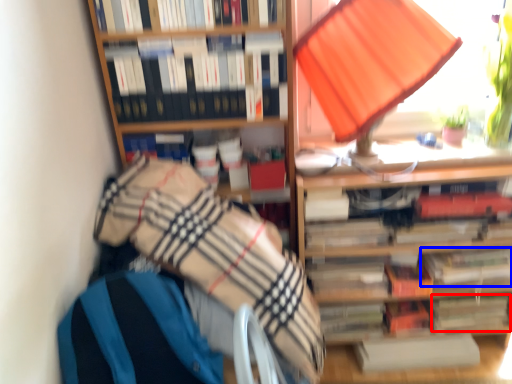
Question: Among these objects, which one is farthest to the camera, paperback book (highlighted by a red box) or book (highlighted by a blue box)?

Choices:
 (A) paperback book
 (B) book

Answer: (A)